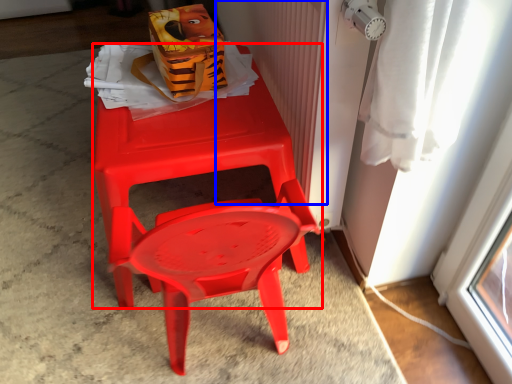
Question: Which of the following is the closest to the observer, chair (highlighted by a red box) or radiator (highlighted by a blue box)?

Choices:
 (A) chair
 (B) radiator

Answer: (B)